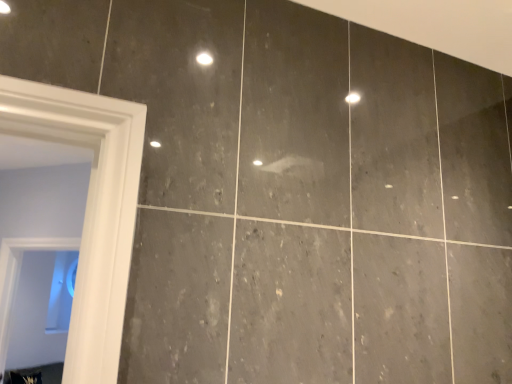
The width and height of the screenshot is (512, 384). In order to click on white glossy screen door at lower left in this screenshot , I will do `click(18, 276)`.

Describe the element at coordinates (18, 276) in the screenshot. I see `white glossy screen door at lower left` at that location.

The height and width of the screenshot is (384, 512). What are the coordinates of `white glossy screen door at lower left` in the screenshot? It's located at (18, 276).